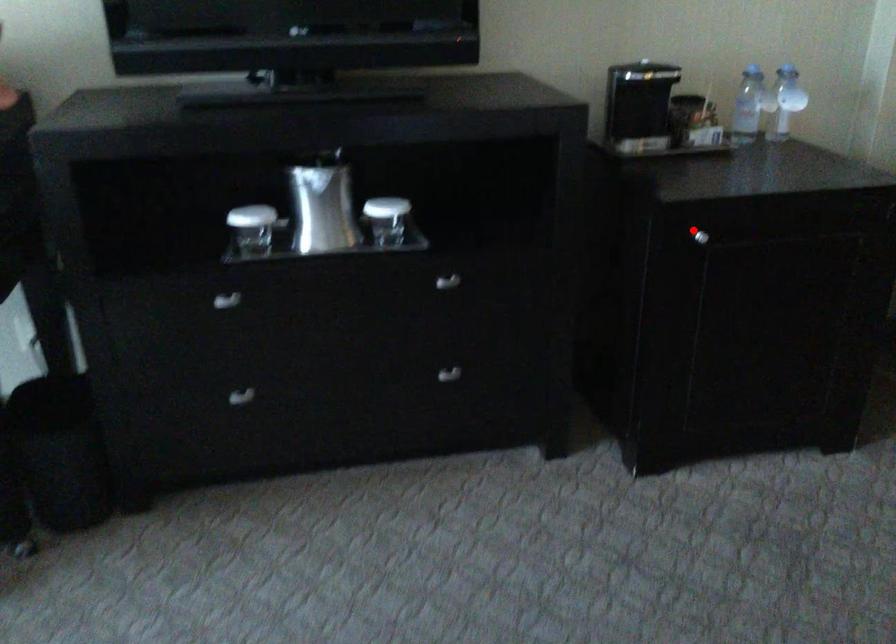
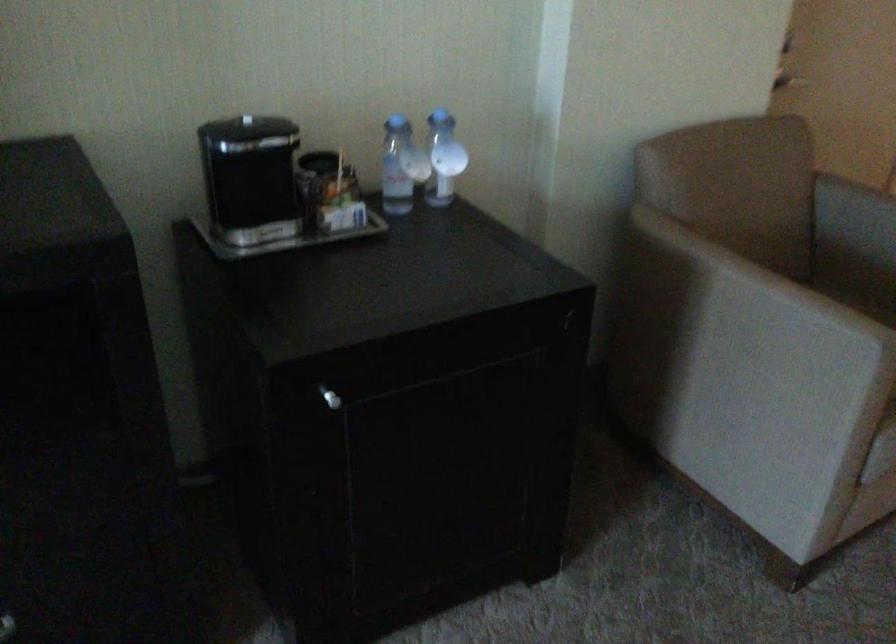
Question: I am providing you with two images of the same scene from different viewpoints. A red point is shown in image1. For the corresponding object point in image2, is it positioned nearer or farther from the camera?

Choices:
 (A) Nearer
 (B) Farther

Answer: (A)